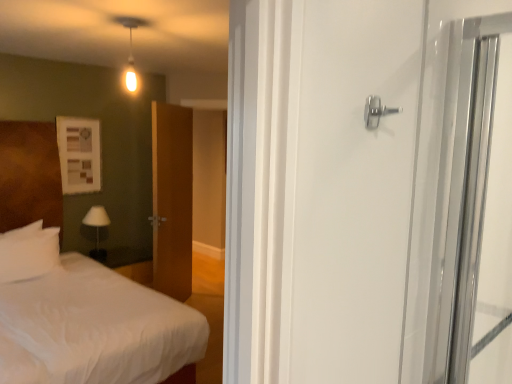
Question: Should I look upward or downward to see white soft pillow at left?

Choices:
 (A) up
 (B) down

Answer: (B)

Question: Is polished silver door handle at upper right at the back of white fabric lampshade at left?

Choices:
 (A) no
 (B) yes

Answer: (A)

Question: Can you confirm if white fabric lampshade at left is taller than polished silver door handle at upper right?

Choices:
 (A) yes
 (B) no

Answer: (A)

Question: From a real-world perspective, is white fabric lampshade at left physically below polished silver door handle at upper right?

Choices:
 (A) no
 (B) yes

Answer: (B)

Question: Is white fabric lampshade at left closer to camera compared to polished silver door handle at upper right?

Choices:
 (A) no
 (B) yes

Answer: (A)

Question: Can you confirm if white fabric lampshade at left is positioned to the left of polished silver door handle at upper right?

Choices:
 (A) no
 (B) yes

Answer: (B)

Question: Considering the relative positions of white fabric lampshade at left and polished silver door handle at upper right in the image provided, is white fabric lampshade at left to the right of polished silver door handle at upper right from the viewer's perspective?

Choices:
 (A) yes
 (B) no

Answer: (B)

Question: Can you confirm if white fabric lampshade at left is bigger than white soft pillow at left?

Choices:
 (A) yes
 (B) no

Answer: (B)

Question: Does white fabric lampshade at left have a greater height compared to white soft pillow at left?

Choices:
 (A) yes
 (B) no

Answer: (B)

Question: Can you confirm if white fabric lampshade at left is positioned to the right of white soft pillow at left?

Choices:
 (A) no
 (B) yes

Answer: (B)

Question: From a real-world perspective, does white fabric lampshade at left stand above white soft pillow at left?

Choices:
 (A) no
 (B) yes

Answer: (A)

Question: Is white fabric lampshade at left far away from white soft pillow at left?

Choices:
 (A) yes
 (B) no

Answer: (B)

Question: Is white soft pillow at left inside white fabric lampshade at left?

Choices:
 (A) no
 (B) yes

Answer: (A)

Question: Is white soft bed at left beside white fabric lampshade at left?

Choices:
 (A) no
 (B) yes

Answer: (A)